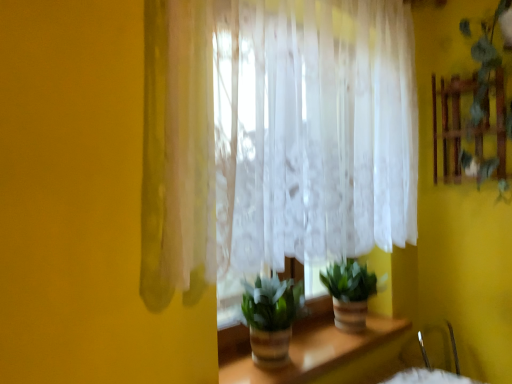
Question: Is green matte plant at center, placed as the 2th houseplant when sorted from front to back, to the left or to the right of green matte plant at center, which is counted as the first houseplant, starting from the left, in the image?

Choices:
 (A) left
 (B) right

Answer: (B)

Question: From the image's perspective, is green matte plant at center, placed as the 1th houseplant when sorted from back to front, positioned above or below green matte plant at center, marked as the 2th houseplant in a right-to-left arrangement?

Choices:
 (A) below
 (B) above

Answer: (B)

Question: Based on their relative distances, which object is nearer to the green leafy plant at upper right?

Choices:
 (A) translucent glass vase at center
 (B) green matte plant at center, which is counted as the second houseplant, starting from the left
 (C) green matte plant at center, which is counted as the first houseplant, starting from the left
 (D) translucent white curtain at center

Answer: (D)

Question: Which is nearer to the translucent white curtain at center?

Choices:
 (A) translucent glass vase at center
 (B) green matte plant at center, the first houseplant positioned from the right
 (C) green matte plant at center, which ranks as the 2th houseplant in back-to-front order
 (D) green leafy plant at upper right

Answer: (C)